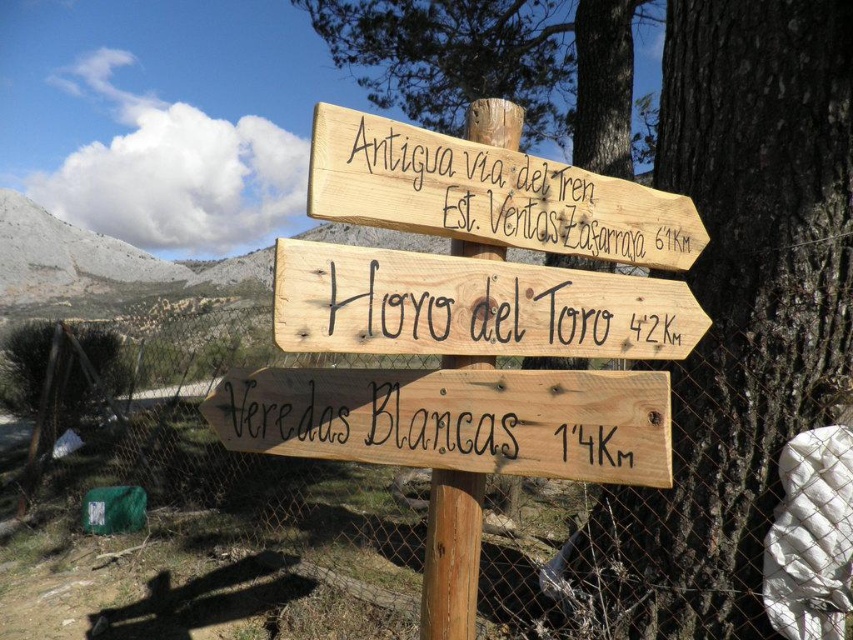
Can you confirm if natural wood signpost at center is smaller than natural wood sign at center?

Incorrect, natural wood signpost at center is not smaller in size than natural wood sign at center.

Who is positioned more to the left, natural wood signpost at center or natural wood sign at center?

natural wood sign at center

Who is more distant from viewer, (757, 620) or (606, 320)?

The point (757, 620) is behind.

Locate an element on the screen. natural wood signpost at center is located at coordinates (738, 308).

Who is lower down, natural wood signpost at center or wooden signpost at upper center?

wooden signpost at upper center is below.

From the picture: Does natural wood signpost at center have a smaller size compared to wooden signpost at upper center?

Actually, natural wood signpost at center might be larger than wooden signpost at upper center.

Which is behind, point (757, 179) or point (515, 234)?

Point (757, 179)

Where is `natural wood signpost at center`? This screenshot has width=853, height=640. natural wood signpost at center is located at coordinates (738, 308).

Identify the location of natural wood sign at center. Image resolution: width=853 pixels, height=640 pixels. (471, 307).

Does point (281, 328) come behind point (694, 220)?

That is False.

Identify the location of natural wood sign at center. (471, 307).